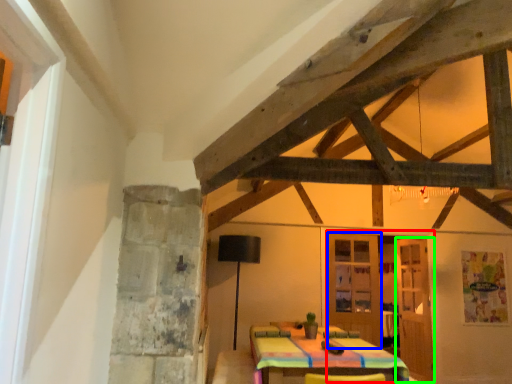
Question: Which object is positioned closest to door (highlighted by a red box)? Select from door (highlighted by a blue box) and door (highlighted by a green box).

Choices:
 (A) door
 (B) door

Answer: (B)